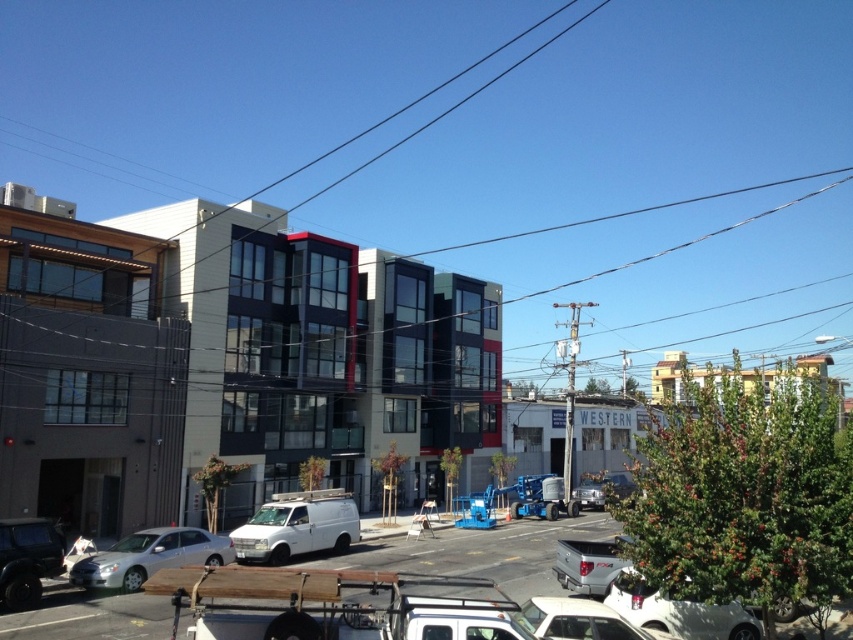
Is white matte car at lower right in front of silver metallic truck at lower center?

Yes.

Which is in front, point (659, 608) or point (567, 579)?

Point (659, 608) is more forward.

Where is `white matte car at lower right`? The width and height of the screenshot is (853, 640). white matte car at lower right is located at coordinates (677, 611).

Can you confirm if white matte car at lower center is positioned to the left of silver metallic truck at lower center?

Indeed, white matte car at lower center is positioned on the left side of silver metallic truck at lower center.

Between point (546, 628) and point (618, 541), which one is positioned behind?

Positioned behind is point (618, 541).

Is point (608, 632) less distant than point (560, 576)?

That is True.

Locate an element on the screen. This screenshot has height=640, width=853. white matte car at lower center is located at coordinates (579, 620).

Does white matte van at lower center have a smaller size compared to silver metallic truck at lower center?

Actually, white matte van at lower center might be larger than silver metallic truck at lower center.

Is point (238, 536) behind point (577, 556)?

Yes, point (238, 536) is farther from viewer.

This screenshot has height=640, width=853. Find the location of `white matte van at lower center`. white matte van at lower center is located at coordinates (297, 525).